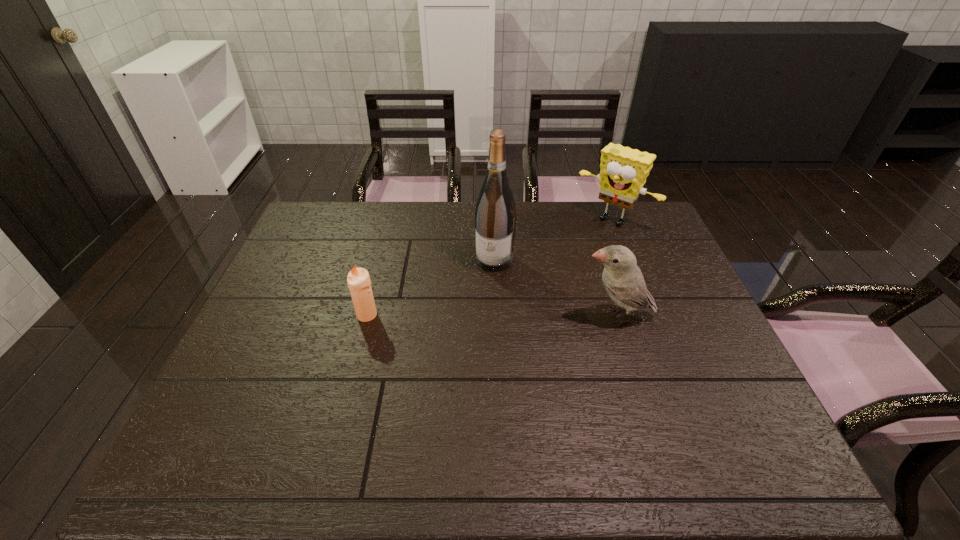
What are the coordinates of `vacant space that is in between the bird and the candle` in the screenshot? It's located at (492, 315).

Point out which object is positioned as the third nearest to the candle. Please provide its 2D coordinates. Your answer should be formatted as a tuple, i.e. [(x, y)], where the tuple contains the x and y coordinates of a point satisfying the conditions above.

[(623, 171)]

Identify which object is located as the second nearest to the third object from right to left. Please provide its 2D coordinates. Your answer should be formatted as a tuple, i.e. [(x, y)], where the tuple contains the x and y coordinates of a point satisfying the conditions above.

[(623, 171)]

What are the coordinates of `vacant area in the image that satisfies the following two spatial constraints: 1. on the front side of the bird; 2. at the face of the third object from right to left` in the screenshot? It's located at (496, 316).

At what (x,y) coordinates should I click in order to perform the action: click on blank space that satisfies the following two spatial constraints: 1. on the front side of the wine bottle; 2. at the face of the bird. Please return your answer as a coordinate pair (x, y). This screenshot has height=540, width=960. Looking at the image, I should click on (496, 316).